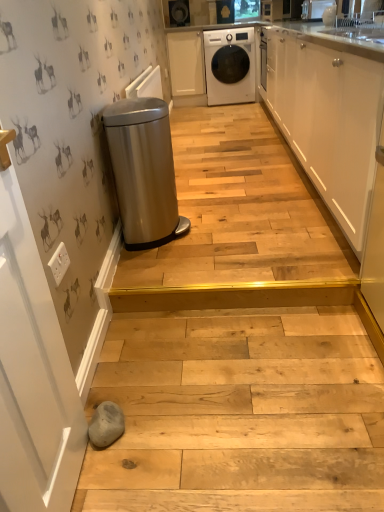
Question: From the image's perspective, is white matte cabinet at center, the first cabinetry when ordered from back to front, below white glossy washing machine at upper center?

Choices:
 (A) no
 (B) yes

Answer: (A)

Question: From the image's perspective, does white matte cabinet at center, positioned as the first cabinetry in left-to-right order, appear higher than white glossy washing machine at upper center?

Choices:
 (A) no
 (B) yes

Answer: (B)

Question: Is white matte cabinet at center, which appears as the 2th cabinetry when viewed from the right, not close to white glossy washing machine at upper center?

Choices:
 (A) no
 (B) yes

Answer: (A)

Question: Is white matte cabinet at center, the 2th cabinetry from the front, smaller than white glossy washing machine at upper center?

Choices:
 (A) yes
 (B) no

Answer: (A)

Question: Is white matte cabinet at center, the second cabinetry positioned from the bottom, aimed at white glossy washing machine at upper center?

Choices:
 (A) yes
 (B) no

Answer: (B)

Question: Is white matte cabinet at center, the second cabinetry positioned from the bottom, to the left of white glossy washing machine at upper center from the viewer's perspective?

Choices:
 (A) no
 (B) yes

Answer: (B)

Question: Can you confirm if white matte cabinet at center, the 2th cabinetry from the front, is shorter than white glossy vase at upper center?

Choices:
 (A) yes
 (B) no

Answer: (B)

Question: Does white matte cabinet at center, the second cabinetry positioned from the bottom, turn towards white glossy vase at upper center?

Choices:
 (A) no
 (B) yes

Answer: (A)

Question: From a real-world perspective, is white matte cabinet at center, the 2th cabinetry from the front, on white glossy vase at upper center?

Choices:
 (A) yes
 (B) no

Answer: (B)

Question: Is white glossy vase at upper center at the back of white matte cabinet at center, the second cabinetry positioned from the bottom?

Choices:
 (A) yes
 (B) no

Answer: (B)

Question: Considering the relative positions of white matte cabinet at center, the second cabinetry positioned from the bottom, and white glossy vase at upper center in the image provided, is white matte cabinet at center, the second cabinetry positioned from the bottom, to the right of white glossy vase at upper center from the viewer's perspective?

Choices:
 (A) yes
 (B) no

Answer: (B)

Question: Considering the relative sizes of white matte cabinet at center, positioned as the 1th cabinetry in top-to-bottom order, and white glossy vase at upper center in the image provided, is white matte cabinet at center, positioned as the 1th cabinetry in top-to-bottom order, wider than white glossy vase at upper center?

Choices:
 (A) no
 (B) yes

Answer: (B)

Question: From a real-world perspective, does white glossy cabinet at upper right, which is the first cabinetry from right to left, sit lower than stainless steel trash can at left?

Choices:
 (A) no
 (B) yes

Answer: (A)